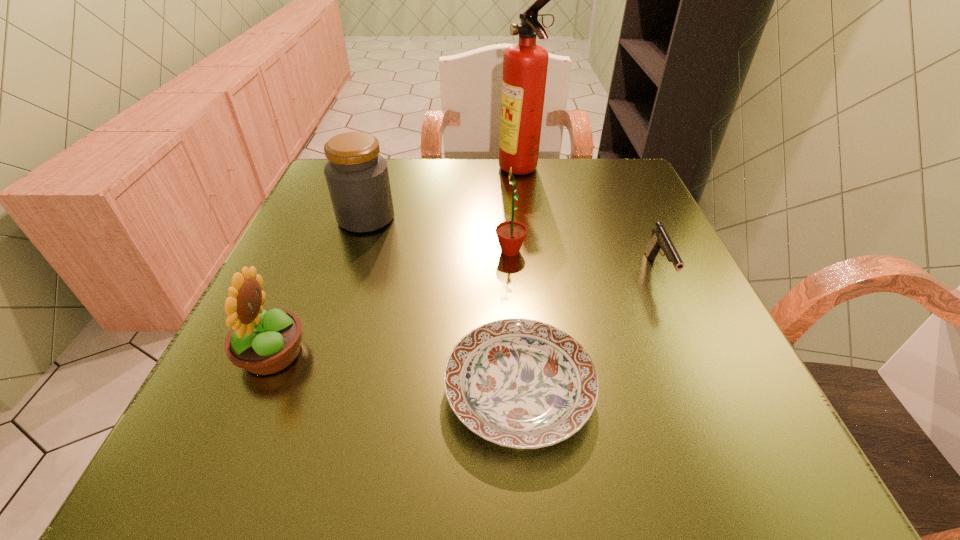
You are a GUI agent. You are given a task and a screenshot of the screen. Output one action in this format:
    pyautogui.click(x=<x>, y=<y>)
    Task: Click on the free space between the jar and the farthest object
    
    Given the screenshot: What is the action you would take?
    pyautogui.click(x=444, y=194)

Where is `free point between the nearer sunflower and the shortest object`? Image resolution: width=960 pixels, height=540 pixels. free point between the nearer sunflower and the shortest object is located at coordinates (396, 373).

The height and width of the screenshot is (540, 960). I want to click on vacant area between the farthest object and the left sunflower, so click(396, 262).

Locate an element on the screen. vacant area that lies between the left sunflower and the jar is located at coordinates (320, 286).

Image resolution: width=960 pixels, height=540 pixels. What are the coordinates of `vacant area that lies between the fifth nearest object and the left sunflower` in the screenshot? It's located at (320, 286).

I want to click on vacant region between the nearer sunflower and the jar, so click(320, 286).

Identify the location of empty space between the farthest object and the nearer sunflower. (396, 262).

What are the coordinates of `free space between the shortest object and the nearer sunflower` in the screenshot? It's located at (396, 373).

Locate an element on the screen. vacant space that is in between the left sunflower and the right sunflower is located at coordinates (391, 302).

Locate which object ranks fourth in proximity to the second shortest object. Please provide its 2D coordinates. Your answer should be formatted as a tuple, i.e. [(x, y)], where the tuple contains the x and y coordinates of a point satisfying the conditions above.

[(357, 177)]